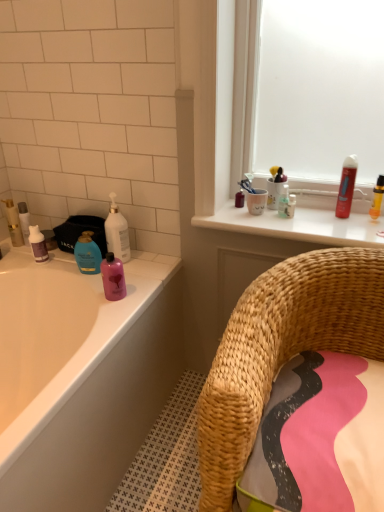
Question: Is woven straw chair at lower right in front of or behind white glossy bottle at upper left in the image?

Choices:
 (A) behind
 (B) front

Answer: (B)

Question: In the image, is woven straw chair at lower right on the left side or the right side of white glossy bottle at upper left?

Choices:
 (A) right
 (B) left

Answer: (A)

Question: Which object is the farthest from the translucent yellow bottle at upper right, the 6th toiletry viewed from the left?

Choices:
 (A) purple matte bottle at left, arranged as the second mouthwash when ordered from the bottom
 (B) white glossy bottle at upper left
 (C) pink fabric bath towel at lower right
 (D) red glossy mouthwash at upper right, the 1th mouthwash viewed from the top
 (E) matte white bathtub at left

Answer: (A)

Question: Which of these objects is positioned farthest from the white glossy counter top at upper center?

Choices:
 (A) pink fabric bath towel at lower right
 (B) translucent plastic toothbrush holder at upper center, the 2th toiletry in the right-to-left sequence
 (C) translucent yellow bottle at upper right, positioned as the first toiletry in right-to-left order
 (D) woven straw chair at lower right
 (E) matte white bathtub at left

Answer: (E)